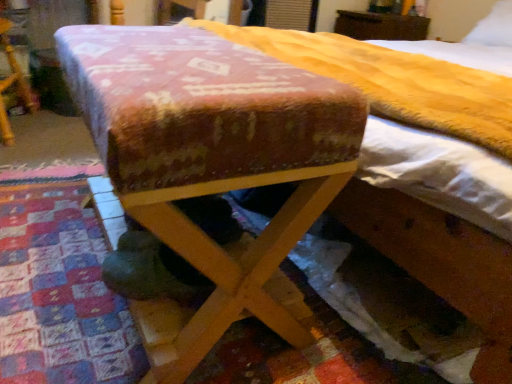
Question: Is white soft pillow at upper right at the back of wooden bed at center?

Choices:
 (A) yes
 (B) no

Answer: (A)

Question: Is wooden bed at center bigger than white soft pillow at upper right?

Choices:
 (A) yes
 (B) no

Answer: (A)

Question: Is wooden bed at center closer to camera compared to white soft pillow at upper right?

Choices:
 (A) no
 (B) yes

Answer: (B)

Question: Can you confirm if wooden bed at center is taller than white soft pillow at upper right?

Choices:
 (A) no
 (B) yes

Answer: (B)

Question: Is wooden bed at center aimed at white soft pillow at upper right?

Choices:
 (A) yes
 (B) no

Answer: (B)

Question: Is there a large distance between wooden bed at center and white soft pillow at upper right?

Choices:
 (A) no
 (B) yes

Answer: (B)

Question: Is velvet-like fabric ottoman at center, the second furniture when ordered from left to right, a part of wooden bed at center?

Choices:
 (A) yes
 (B) no

Answer: (B)

Question: Considering the relative sizes of wooden bed at center and velvet-like fabric ottoman at center, the third furniture in the back-to-front sequence, in the image provided, is wooden bed at center taller than velvet-like fabric ottoman at center, the third furniture in the back-to-front sequence,?

Choices:
 (A) yes
 (B) no

Answer: (A)

Question: From the image's perspective, is wooden bed at center located above velvet-like fabric ottoman at center, the second furniture in the right-to-left sequence?

Choices:
 (A) yes
 (B) no

Answer: (A)

Question: Can you confirm if wooden bed at center is shorter than velvet-like fabric ottoman at center, the first furniture when ordered from front to back?

Choices:
 (A) yes
 (B) no

Answer: (B)

Question: Does wooden bed at center have a lesser width compared to velvet-like fabric ottoman at center, the first furniture when ordered from front to back?

Choices:
 (A) no
 (B) yes

Answer: (A)

Question: Is the position of wooden bed at center less distant than that of velvet-like fabric ottoman at center, the second furniture in the right-to-left sequence?

Choices:
 (A) no
 (B) yes

Answer: (B)

Question: Is wooden bed at center aimed at brown wooden dresser at upper center, the third furniture viewed from the front?

Choices:
 (A) yes
 (B) no

Answer: (B)